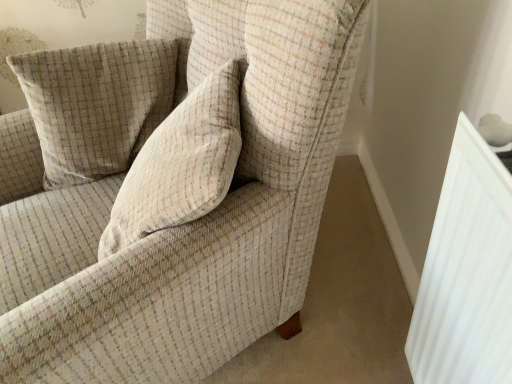
Question: In terms of width, does beige textured cushion at upper left look wider or thinner when compared to textured beige armchair at center?

Choices:
 (A) thin
 (B) wide

Answer: (A)

Question: Is beige textured cushion at upper left to the left or to the right of textured beige armchair at center in the image?

Choices:
 (A) left
 (B) right

Answer: (A)

Question: Which of these objects is positioned farthest from the textured beige armchair at center?

Choices:
 (A) white ribbed radiator at right
 (B) beige textured cushion at upper left

Answer: (A)

Question: Considering the real-world distances, which object is closest to the beige textured cushion at upper left?

Choices:
 (A) white ribbed radiator at right
 (B) textured beige armchair at center

Answer: (B)